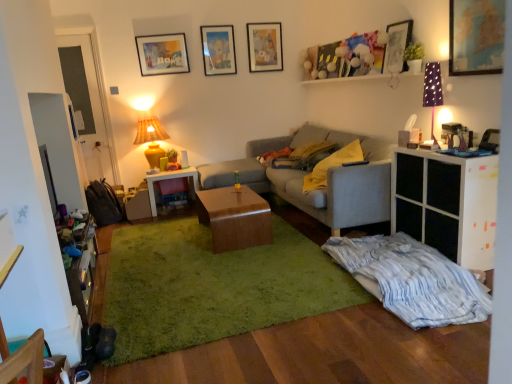
The width and height of the screenshot is (512, 384). Find the location of `vacant point above green shaggy rug at center (from a real-world perspective)`. vacant point above green shaggy rug at center (from a real-world perspective) is located at coordinates (217, 266).